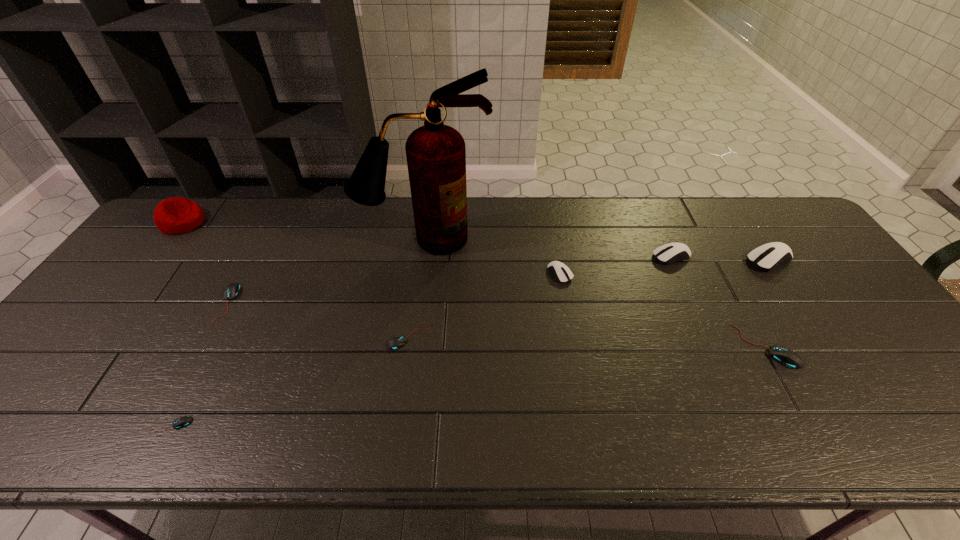
Where is `free space that is in between the beanbag and the leftmost white mouse`? This screenshot has width=960, height=540. free space that is in between the beanbag and the leftmost white mouse is located at coordinates (372, 248).

At what (x,y) coordinates should I click in order to perform the action: click on vacant space that's between the beanbag and the smallest white mouse. Please return your answer as a coordinate pair (x, y). Looking at the image, I should click on coord(372,248).

The image size is (960, 540). I want to click on vacant space that's between the smallest white mouse and the second black mouse from right to left, so 485,306.

The image size is (960, 540). What are the coordinates of `free point between the third black mouse from left to right and the tallest object` in the screenshot? It's located at (417, 289).

This screenshot has width=960, height=540. In order to click on vacant space in between the tallest object and the third biggest black mouse in this screenshot , I will do (x=417, y=289).

Where is `unoccupied position between the red fire extinguisher and the rightmost white mouse`? The image size is (960, 540). unoccupied position between the red fire extinguisher and the rightmost white mouse is located at coordinates click(596, 250).

The image size is (960, 540). I want to click on object that is the third closest to the sixth object from left to right, so pyautogui.click(x=399, y=340).

Locate an element on the screen. Image resolution: width=960 pixels, height=540 pixels. the eighth closest object to the rightmost white mouse is located at coordinates (176, 215).

Select which mouse appears as the sixth closest to the rightmost object. Please provide its 2D coordinates. Your answer should be formatted as a tuple, i.e. [(x, y)], where the tuple contains the x and y coordinates of a point satisfying the conditions above.

[(181, 422)]

Choose which mouse is the fourth nearest neighbor to the second smallest white mouse. Please provide its 2D coordinates. Your answer should be formatted as a tuple, i.e. [(x, y)], where the tuple contains the x and y coordinates of a point satisfying the conditions above.

[(399, 340)]